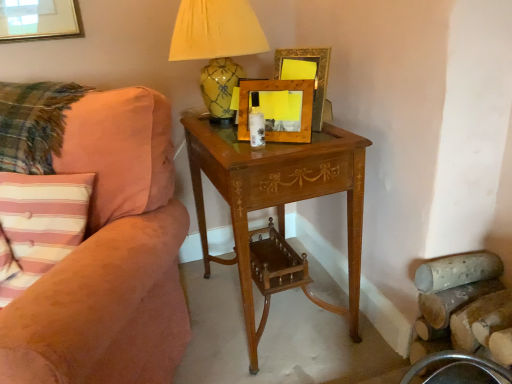
Locate an element on the screen. The width and height of the screenshot is (512, 384). pink striped fabric pillow at left is located at coordinates (38, 225).

How much space does wooden picture frame at center, arranged as the 1th picture frame when viewed from the front, occupy horizontally?

wooden picture frame at center, arranged as the 1th picture frame when viewed from the front, is 2.99 inches wide.

Where is `suede-like peach couch at left`? Image resolution: width=512 pixels, height=384 pixels. suede-like peach couch at left is located at coordinates (109, 257).

You are a GUI agent. You are given a task and a screenshot of the screen. Output one action in this format:
    pyautogui.click(x=<x>, y=<y>)
    Task: Click on the pink striped fabric pillow at left
    Image resolution: width=512 pixels, height=384 pixels.
    Given the screenshot: What is the action you would take?
    click(38, 225)

Can we say wooden picture frame at upper center, the 1th picture frame in the back-to-front sequence, lies outside light brown wood nightstand at center?

Indeed, wooden picture frame at upper center, the 1th picture frame in the back-to-front sequence, is completely outside light brown wood nightstand at center.

Considering the relative sizes of wooden picture frame at upper center, placed as the 2th picture frame when sorted from front to back, and light brown wood nightstand at center in the image provided, is wooden picture frame at upper center, placed as the 2th picture frame when sorted from front to back, smaller than light brown wood nightstand at center?

Yes, wooden picture frame at upper center, placed as the 2th picture frame when sorted from front to back, is smaller than light brown wood nightstand at center.

Where is `nightstand in front of the wooden picture frame at upper center, the 1th picture frame in the back-to-front sequence`? nightstand in front of the wooden picture frame at upper center, the 1th picture frame in the back-to-front sequence is located at coordinates (277, 198).

From the image's perspective, is yellow glazed ceramic lamp at upper center under wooden picture frame at center, arranged as the 1th picture frame when viewed from the front?

No, from the image's perspective, yellow glazed ceramic lamp at upper center is not below wooden picture frame at center, arranged as the 1th picture frame when viewed from the front.

Is yellow glazed ceramic lamp at upper center inside or outside of wooden picture frame at center, which appears as the second picture frame when viewed from the back?

yellow glazed ceramic lamp at upper center is not inside wooden picture frame at center, which appears as the second picture frame when viewed from the back, it's outside.

Is wooden picture frame at center, which appears as the second picture frame when viewed from the back, at the back of yellow glazed ceramic lamp at upper center?

No.

Are yellow glazed ceramic lamp at upper center and wooden picture frame at center, which appears as the second picture frame when viewed from the back, far apart?

yellow glazed ceramic lamp at upper center is near wooden picture frame at center, which appears as the second picture frame when viewed from the back, not far away.

How many degrees apart are the facing directions of light brown wood nightstand at center and suede-like peach couch at left?

The angle between the facing direction of light brown wood nightstand at center and the facing direction of suede-like peach couch at left is 62.5 degrees.

Is light brown wood nightstand at center looking in the opposite direction of suede-like peach couch at left?

No, suede-like peach couch at left is not at the back of light brown wood nightstand at center.

Considering the sizes of objects light brown wood nightstand at center and suede-like peach couch at left in the image provided, who is taller, light brown wood nightstand at center or suede-like peach couch at left?

Standing taller between the two is suede-like peach couch at left.

Considering the relative sizes of light brown wood nightstand at center and suede-like peach couch at left in the image provided, is light brown wood nightstand at center bigger than suede-like peach couch at left?

Actually, light brown wood nightstand at center might be smaller than suede-like peach couch at left.

Are wooden picture frame at center, which appears as the second picture frame when viewed from the back, and pink striped fabric pillow at left far apart?

wooden picture frame at center, which appears as the second picture frame when viewed from the back, is actually quite close to pink striped fabric pillow at left.

Is wooden picture frame at center, which appears as the second picture frame when viewed from the back, looking in the opposite direction of pink striped fabric pillow at left?

No, pink striped fabric pillow at left is not at the back of wooden picture frame at center, which appears as the second picture frame when viewed from the back.

From a real-world perspective, is wooden picture frame at center, arranged as the 1th picture frame when viewed from the front, located higher than pink striped fabric pillow at left?

Indeed, from a real-world perspective, wooden picture frame at center, arranged as the 1th picture frame when viewed from the front, stands above pink striped fabric pillow at left.

Based on the photo, in terms of height, does wooden picture frame at center, which appears as the second picture frame when viewed from the back, look taller or shorter compared to wooden picture frame at upper center, the 1th picture frame in the back-to-front sequence?

In the image, wooden picture frame at center, which appears as the second picture frame when viewed from the back, appears to be shorter than wooden picture frame at upper center, the 1th picture frame in the back-to-front sequence.

From a real-world perspective, is wooden picture frame at center, arranged as the 1th picture frame when viewed from the front, positioned above or below wooden picture frame at upper center, placed as the 2th picture frame when sorted from front to back?

In terms of real-world spatial position, wooden picture frame at center, arranged as the 1th picture frame when viewed from the front, is below wooden picture frame at upper center, placed as the 2th picture frame when sorted from front to back.

Between wooden picture frame at center, which appears as the second picture frame when viewed from the back, and wooden picture frame at upper center, the 1th picture frame in the back-to-front sequence, which one appears on the right side from the viewer's perspective?

From the viewer's perspective, wooden picture frame at upper center, the 1th picture frame in the back-to-front sequence, appears more on the right side.

Is wooden picture frame at center, which appears as the second picture frame when viewed from the back, facing away from wooden picture frame at upper center, placed as the 2th picture frame when sorted from front to back?

Yes, wooden picture frame at center, which appears as the second picture frame when viewed from the back,'s orientation is away from wooden picture frame at upper center, placed as the 2th picture frame when sorted from front to back.

Locate an element on the screen. pillow below the wooden picture frame at upper center, placed as the 2th picture frame when sorted from front to back (from the image's perspective) is located at coordinates (38, 225).

Would you say wooden picture frame at upper center, placed as the 2th picture frame when sorted from front to back, is outside pink striped fabric pillow at left?

Yes, wooden picture frame at upper center, placed as the 2th picture frame when sorted from front to back, is located beyond the bounds of pink striped fabric pillow at left.

How much distance is there between pink striped fabric pillow at left and wooden picture frame at upper center, the 1th picture frame in the back-to-front sequence?

pink striped fabric pillow at left is 30.65 inches away from wooden picture frame at upper center, the 1th picture frame in the back-to-front sequence.

Can you confirm if pink striped fabric pillow at left is bigger than wooden picture frame at upper center, the 1th picture frame in the back-to-front sequence?

Correct, pink striped fabric pillow at left is larger in size than wooden picture frame at upper center, the 1th picture frame in the back-to-front sequence.

Is pink striped fabric pillow at left located outside wooden picture frame at upper center, the 1th picture frame in the back-to-front sequence?

Yes, pink striped fabric pillow at left is located beyond the bounds of wooden picture frame at upper center, the 1th picture frame in the back-to-front sequence.

Between pink striped fabric pillow at left and wooden picture frame at upper center, the 1th picture frame in the back-to-front sequence, which one has smaller width?

wooden picture frame at upper center, the 1th picture frame in the back-to-front sequence.

Which picture frame is the 2nd one when counting from the back of the light brown wood nightstand at center? Please provide its 2D coordinates.

[(306, 74)]

Locate an element on the screen. The height and width of the screenshot is (384, 512). the 1st picture frame counting from the right side of the yellow glazed ceramic lamp at upper center is located at coordinates [278, 90].

From the image, which object appears to be nearer to wooden picture frame at center, arranged as the 1th picture frame when viewed from the front, suede-like peach couch at left or pink striped fabric pillow at left?

suede-like peach couch at left is positioned closer to the anchor wooden picture frame at center, arranged as the 1th picture frame when viewed from the front.

Based on their spatial positions, is yellow glazed ceramic lamp at upper center or light brown wood nightstand at center closer to suede-like peach couch at left?

Based on the image, light brown wood nightstand at center appears to be nearer to suede-like peach couch at left.

Based on their spatial positions, is yellow glazed ceramic lamp at upper center or pink striped fabric pillow at left closer to light brown wood nightstand at center?

Based on the image, yellow glazed ceramic lamp at upper center appears to be nearer to light brown wood nightstand at center.

From the picture: When comparing their distances from wooden picture frame at center, which appears as the second picture frame when viewed from the back, does pink striped fabric pillow at left or suede-like peach couch at left seem closer?

Among the two, suede-like peach couch at left is located nearer to wooden picture frame at center, which appears as the second picture frame when viewed from the back.

Estimate the real-world distances between objects in this image. Which object is further from pink striped fabric pillow at left, wooden picture frame at center, arranged as the 1th picture frame when viewed from the front, or suede-like peach couch at left?

Based on the image, wooden picture frame at center, arranged as the 1th picture frame when viewed from the front, appears to be further to pink striped fabric pillow at left.

When comparing their distances from yellow glazed ceramic lamp at upper center, does suede-like peach couch at left or wooden picture frame at upper center, the 1th picture frame in the back-to-front sequence, seem closer?

wooden picture frame at upper center, the 1th picture frame in the back-to-front sequence, lies closer to yellow glazed ceramic lamp at upper center than the other object.

Considering their positions, is yellow glazed ceramic lamp at upper center positioned further to pink striped fabric pillow at left than wooden picture frame at center, which appears as the second picture frame when viewed from the back?

Based on the image, yellow glazed ceramic lamp at upper center appears to be further to pink striped fabric pillow at left.

Estimate the real-world distances between objects in this image. Which object is closer to wooden picture frame at center, arranged as the 1th picture frame when viewed from the front, light brown wood nightstand at center or wooden picture frame at upper center, placed as the 2th picture frame when sorted from front to back?

The object closer to wooden picture frame at center, arranged as the 1th picture frame when viewed from the front, is wooden picture frame at upper center, placed as the 2th picture frame when sorted from front to back.

Identify the location of picture frame situated between suede-like peach couch at left and wooden picture frame at upper center, the 1th picture frame in the back-to-front sequence, from left to right. (278, 90).

The height and width of the screenshot is (384, 512). Identify the location of nightstand between suede-like peach couch at left and wooden picture frame at center, arranged as the 1th picture frame when viewed from the front, from left to right. (277, 198).

Locate an element on the screen. This screenshot has height=384, width=512. picture frame between suede-like peach couch at left and yellow glazed ceramic lamp at upper center in the front-back direction is located at coordinates (278, 90).

Locate an element on the screen. The image size is (512, 384). table lamp located between pink striped fabric pillow at left and wooden picture frame at upper center, the 1th picture frame in the back-to-front sequence, in the left-right direction is located at coordinates (217, 45).